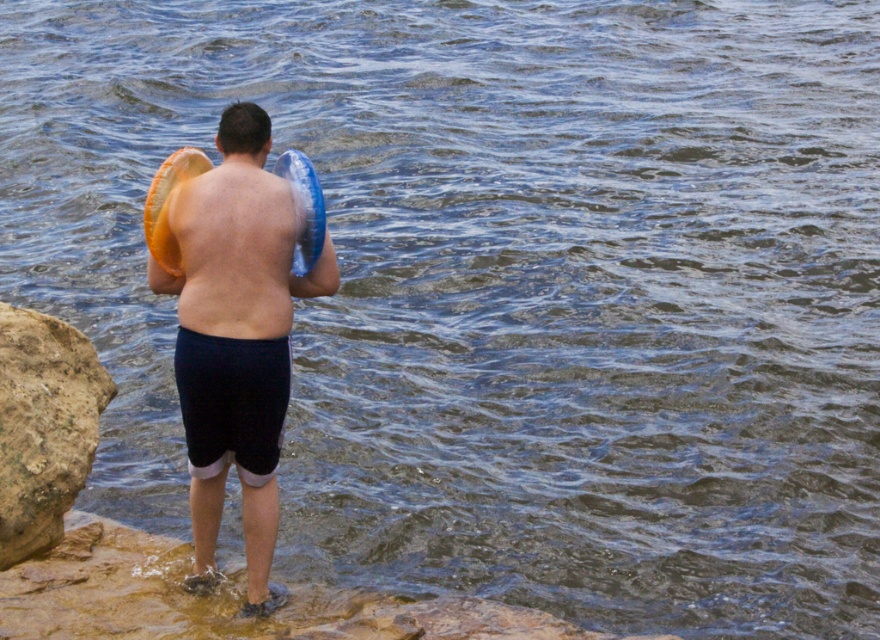
You are a photographer trying to capture the scene with the brown rough rock at lower left and the matte skin at center. Based on their heights, which object should you focus on first if you want to ensure both are in sharp focus?

The brown rough rock at lower left has a greater height compared to matte skin at center, so you should focus on the brown rough rock at lower left first to ensure both are in sharp focus.

You are a photographer wanting to capture the matte orange frisbee at center in your shot. Given the coordinates provided, where should you position your camera relative to the person to ensure the frisbee is centered in the frame?

To center the matte orange frisbee at center in the frame, position your camera directly in line with the coordinates provided, ensuring the frisbee is at the center point of your viewfinder.